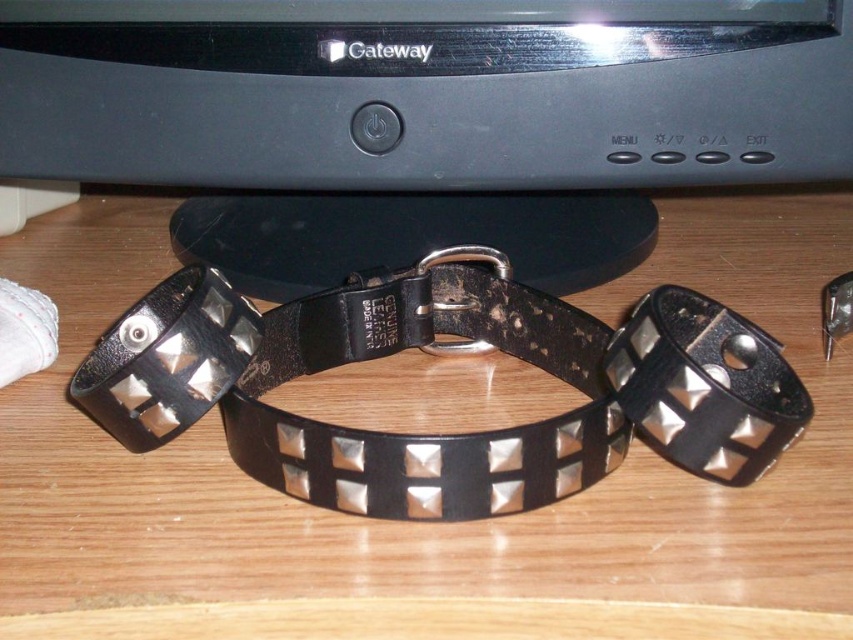
Question: Which of the following is the closest to the observer?

Choices:
 (A) (187, 353)
 (B) (492, 236)
 (C) (773, 368)
 (D) (181, 588)

Answer: (D)

Question: Which object is closer to the camera taking this photo?

Choices:
 (A) black plastic monitor at center
 (B) black leather bracelet at center
 (C) wooden desk at center

Answer: (C)

Question: Is the position of wooden desk at center less distant than that of black plastic monitor at center?

Choices:
 (A) yes
 (B) no

Answer: (A)

Question: Among these points, which one is nearest to the camera?

Choices:
 (A) (618, 99)
 (B) (828, 390)
 (C) (235, 314)

Answer: (C)

Question: Can you confirm if wooden desk at center is thinner than black leather studded bracelet at center?

Choices:
 (A) no
 (B) yes

Answer: (A)

Question: Does wooden desk at center lie behind black plastic monitor at center?

Choices:
 (A) yes
 (B) no

Answer: (B)